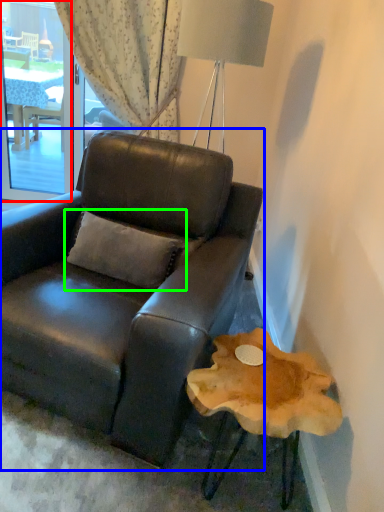
Question: Estimate the real-world distances between objects in this image. Which object is closer to window screen (highlighted by a red box), chair (highlighted by a blue box) or pillow (highlighted by a green box)?

Choices:
 (A) chair
 (B) pillow

Answer: (A)